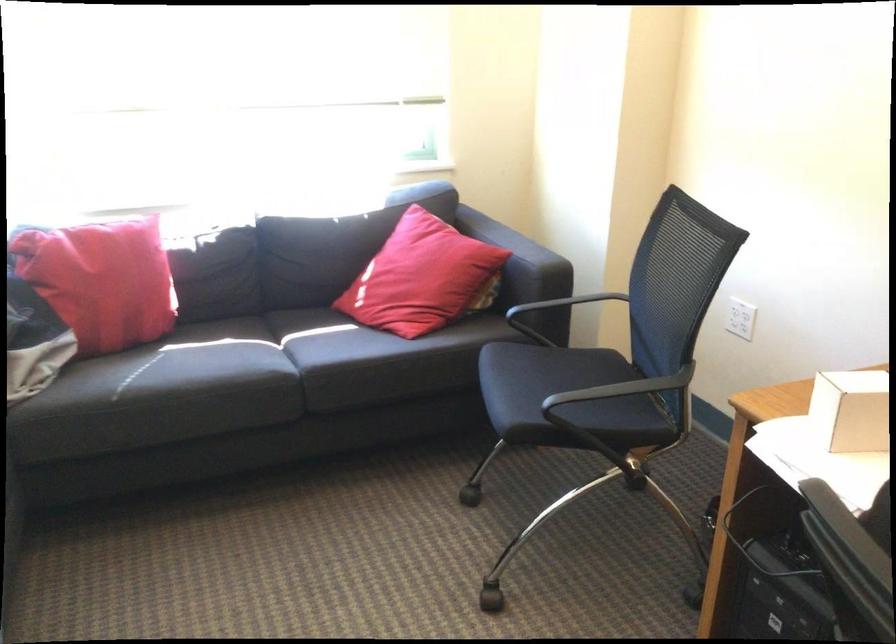
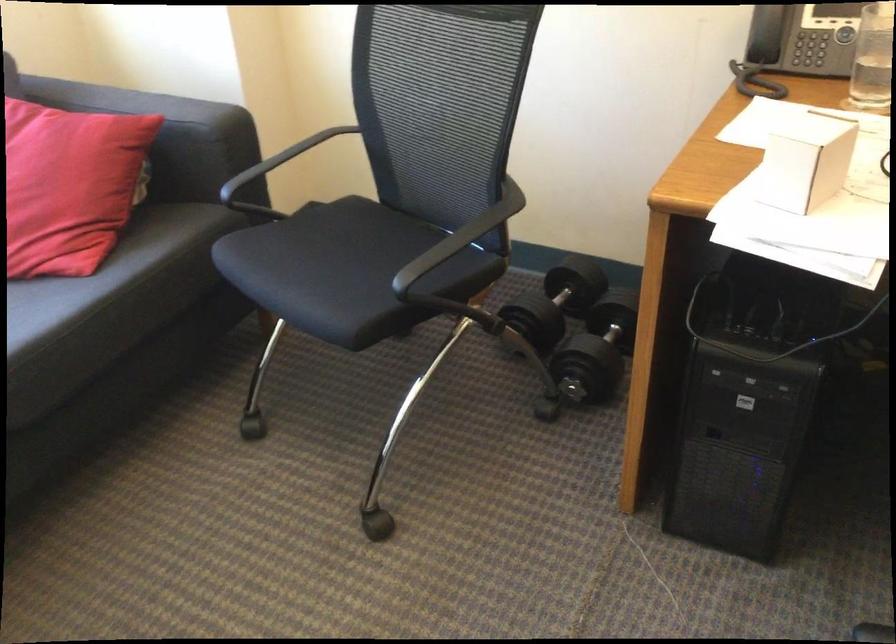
First-person continuous shooting, in which direction is the camera rotating?

The camera rotated toward right-down.